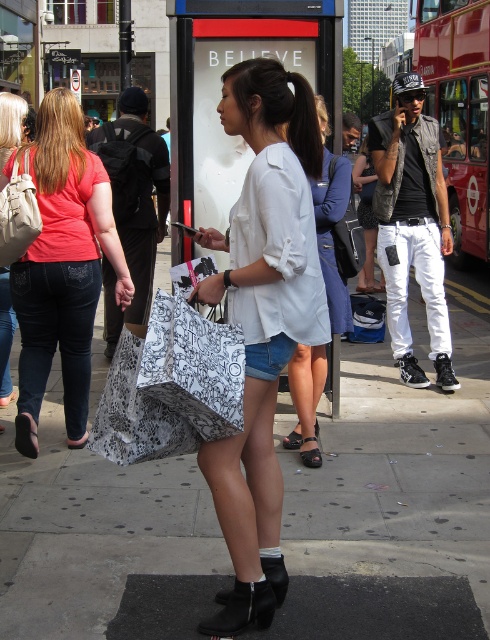
You are a photographer trying to capture a photo of the two points in the scene. The first point is at coordinates point (261, 268) and the second is at point (228, 605). Since you want both points to be in focus, which point should you focus on to ensure both are sharp?

You should focus on point (261, 268) because it is closer to the camera than point (228, 605). By focusing on the closer point, the farther point will still be within the depth of field and appear sharp.

You are a fashion designer observing the scene. You notice the white cotton shirt at center and the black suede boot at lower center. Which clothing item is closer to the viewer?

The white cotton shirt at center is closer to the viewer because it is in front of the black suede boot at lower center.

What is the exact coordinate of the denim jeans at center?

The denim jeans at center is located at point (65, 262).